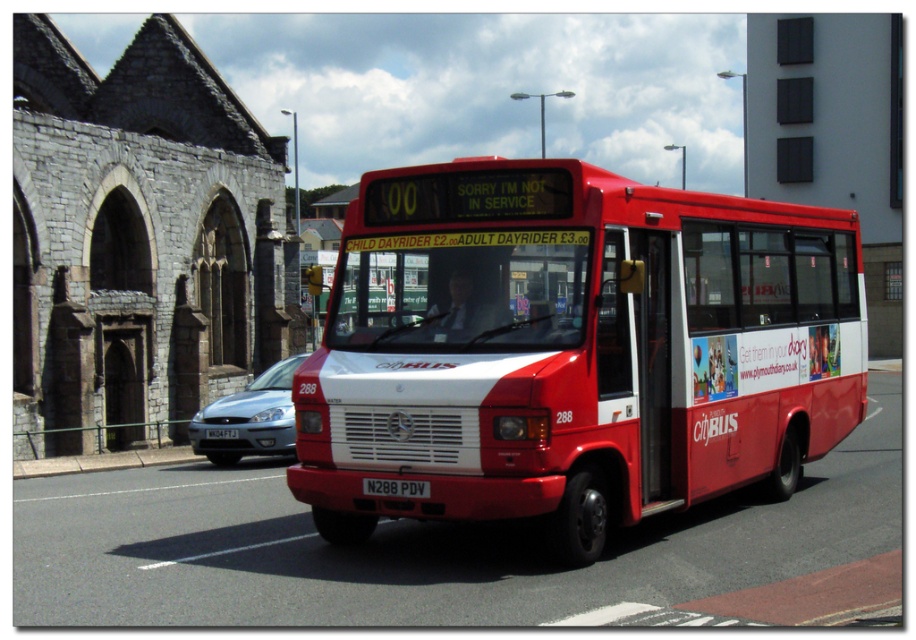
You are standing at the point with coordinates (573, 349) in the image. What object are you standing on?

The point at coordinates (573, 349) is on the red matte bus at center.

You are standing at the intersection and want to take the red matte bus at center to the city center. According to the bus information, can you board the bus right now?

The red matte bus at center displays a sign stating it is not in service, so you cannot board it right now.

You are a pedestrian standing on the sidewalk and see the gray stone church at center and the white plastic license plate at center. Which one is located to the left?

The gray stone church at center is positioned on the left side of white plastic license plate at center, so the gray stone church at center is located to the left.